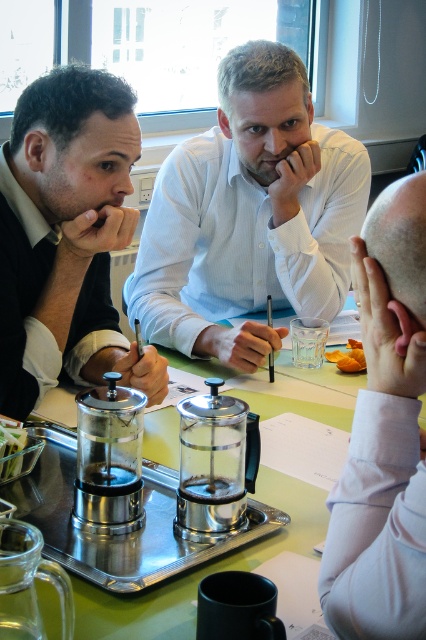
Which is above, white textured shirt at center or smooth skin head at right?

white textured shirt at center is higher up.

Which is below, white textured shirt at center or smooth skin head at right?

smooth skin head at right is lower down.

You are a GUI agent. You are given a task and a screenshot of the screen. Output one action in this format:
    pyautogui.click(x=<x>, y=<y>)
    Task: Click on the white textured shirt at center
    The width and height of the screenshot is (426, 640).
    Given the screenshot: What is the action you would take?
    pyautogui.click(x=250, y=216)

The width and height of the screenshot is (426, 640). Identify the location of white textured shirt at center. (250, 216).

Can you confirm if smooth skin head at right is positioned above clear glass tray at center?

Yes.

How much distance is there between smooth skin head at right and clear glass tray at center?

smooth skin head at right and clear glass tray at center are 14.33 inches apart from each other.

Measure the distance between point (405, 195) and camera.

Point (405, 195) and camera are 28.77 inches apart from each other.

Image resolution: width=426 pixels, height=640 pixels. I want to click on smooth skin head at right, so click(383, 435).

Between point (331, 220) and point (342, 353), which one is positioned in front?

Positioned in front is point (342, 353).

Is white textured shirt at center wider than orange matte food at center?

Indeed, white textured shirt at center has a greater width compared to orange matte food at center.

Between point (187, 243) and point (339, 356), which one is positioned in front?

Positioned in front is point (339, 356).

Identify the location of white textured shirt at center. This screenshot has height=640, width=426. pos(250,216).